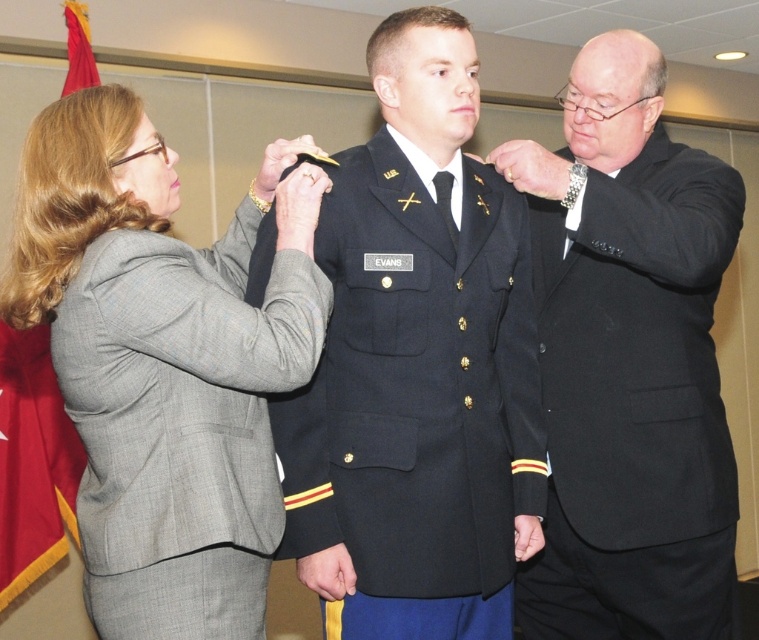
You are an event organizer who needs to ensure all guests are dressed appropriately. You notice the black suit at right and the navy blue wool uniform at center. Which one has a wider width?

The navy blue wool uniform at center has a greater width than the black suit at right.

You are a photographer positioned in front of the scene. You need to capture a closeup shot of the gray wool suit at left without moving your camera. Can you do it?

The gray wool suit at left is 1.32 meters away from viewer, so yes, you can capture a closeup shot without moving your camera as it is within a reasonable distance for closeup photography.

You are a photographer at the event and want to capture a clear shot of the gray wool suit at left and the navy blue wool uniform at center. Which object should you focus on first to ensure both are in focus?

The gray wool suit at left is closer to the viewer than the navy blue wool uniform at center. To ensure both are in focus, focus on the gray wool suit at left first since it is closer, and the depth of field will extend to the navy blue wool uniform at center.